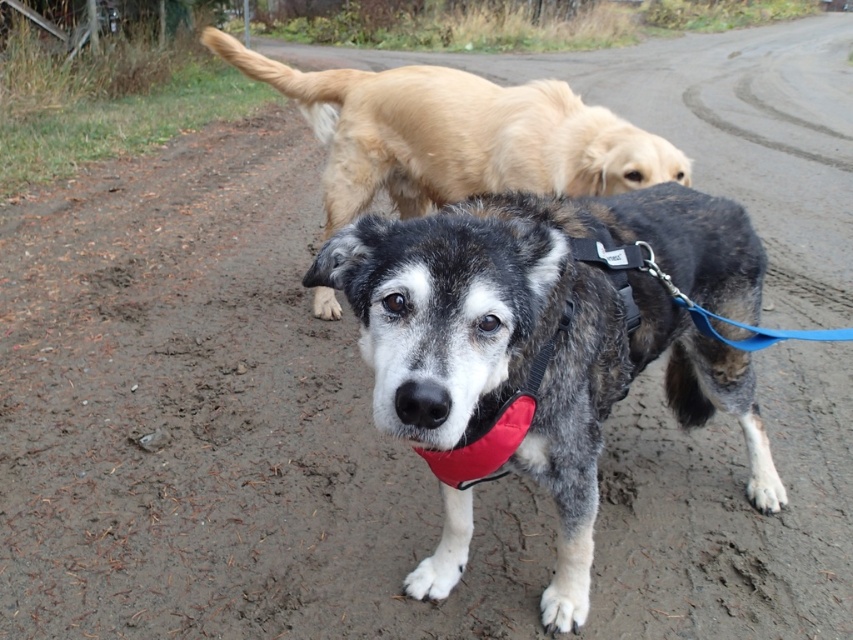
Question: Does speckled fur dog at center appear over golden fur dog at upper center?

Choices:
 (A) yes
 (B) no

Answer: (B)

Question: Among these points, which one is farthest from the camera?

Choices:
 (A) (512, 84)
 (B) (576, 440)
 (C) (547, 360)

Answer: (A)

Question: Is golden fur dog at upper center wider than red fabric neckband at center?

Choices:
 (A) no
 (B) yes

Answer: (B)

Question: Estimate the real-world distances between objects in this image. Which object is closer to the speckled fur dog at center?

Choices:
 (A) red fabric neckband at center
 (B) golden fur dog at upper center

Answer: (A)

Question: Can you confirm if speckled fur dog at center is positioned above golden fur dog at upper center?

Choices:
 (A) no
 (B) yes

Answer: (A)

Question: Which point is farther to the camera?

Choices:
 (A) speckled fur dog at center
 (B) golden fur dog at upper center
 (C) red fabric neckband at center

Answer: (B)